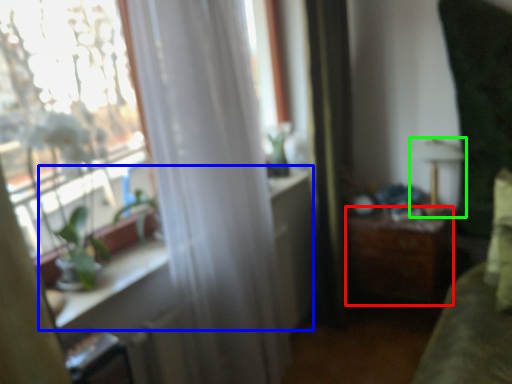
Question: Considering the real-world distances, which object is closest to table (highlighted by a red box)? window sill (highlighted by a blue box) or lamp (highlighted by a green box).

Choices:
 (A) window sill
 (B) lamp

Answer: (B)